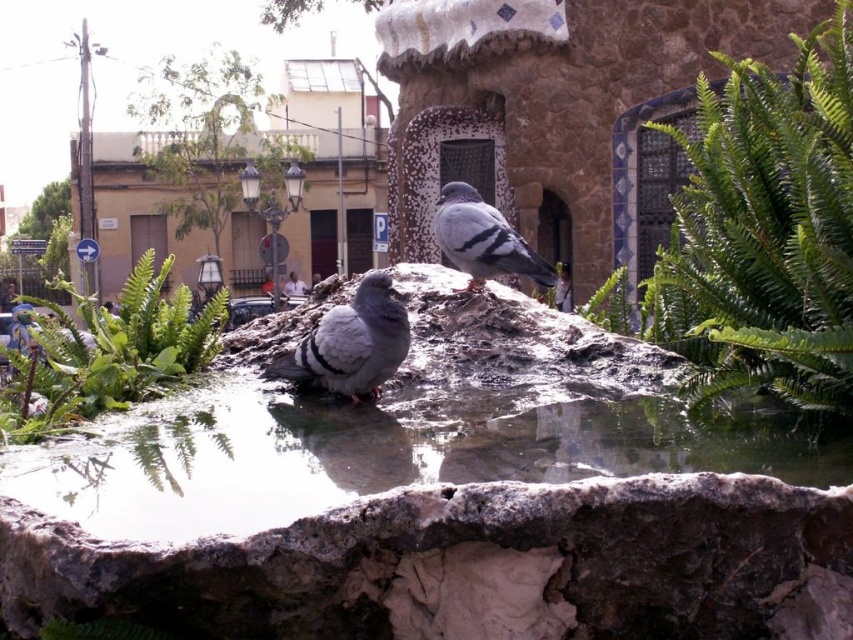
Question: Is green leafy plant at upper center smaller than green leafy plant at center?

Choices:
 (A) no
 (B) yes

Answer: (B)

Question: Considering the real-world distances, which object is farthest from the white fabric couple at center?

Choices:
 (A) gray speckled pigeon at center
 (B) green leafy plant at center

Answer: (A)

Question: Based on their relative distances, which object is farther from the white fabric couple at center?

Choices:
 (A) gray matte pigeon at center
 (B) green leafy plant at upper center

Answer: (A)

Question: Is clear water at center above green leafy plant at upper center?

Choices:
 (A) no
 (B) yes

Answer: (A)

Question: Based on their relative distances, which object is nearer to the clear water at center?

Choices:
 (A) gray matte pigeon at center
 (B) white fabric couple at center

Answer: (A)

Question: Can you confirm if green leafy plant at center is wider than white fabric couple at center?

Choices:
 (A) yes
 (B) no

Answer: (A)